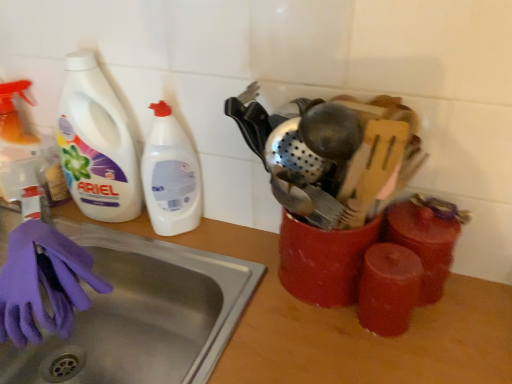
Identify the location of vacant region to the left of white plastic bottle at left. (106, 235).